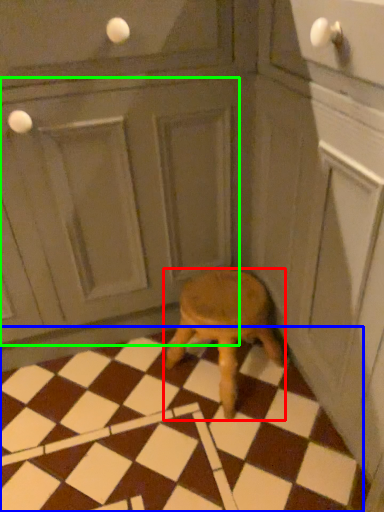
Question: Which is farther away from stool (highlighted by a red box)? tile (highlighted by a blue box) or screen door (highlighted by a green box)?

Choices:
 (A) tile
 (B) screen door

Answer: (B)